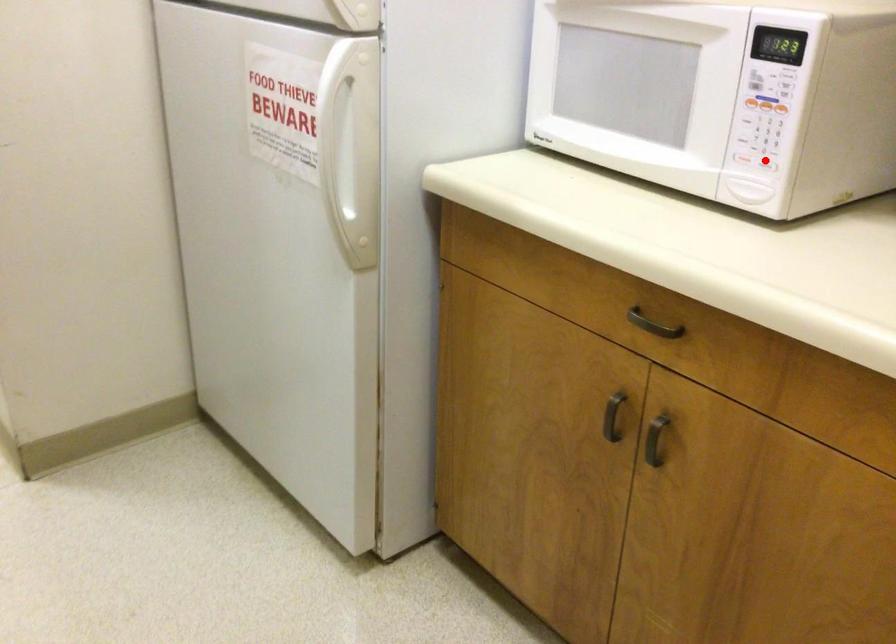
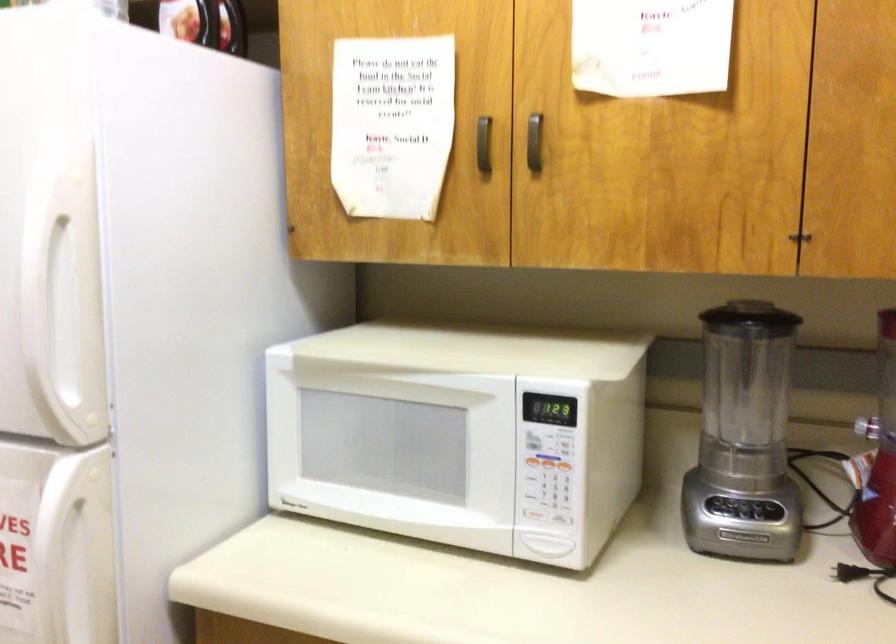
Find the pixel in the second image that matches the highlighted location in the first image.

(563, 518)